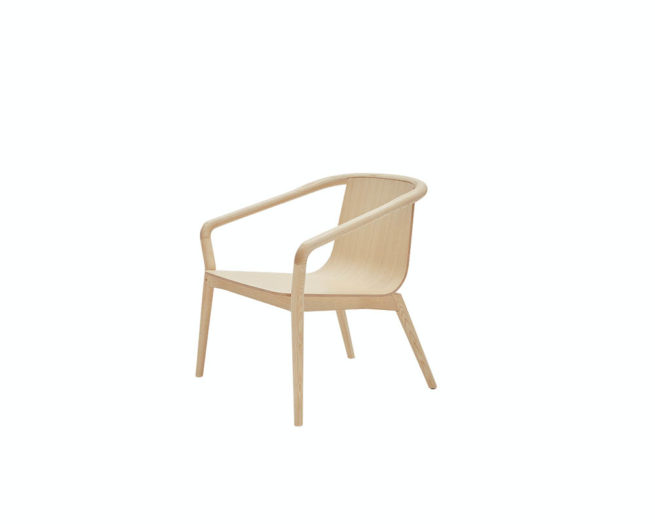
Where is `left arm rest`? Image resolution: width=655 pixels, height=524 pixels. left arm rest is located at coordinates (322, 241).